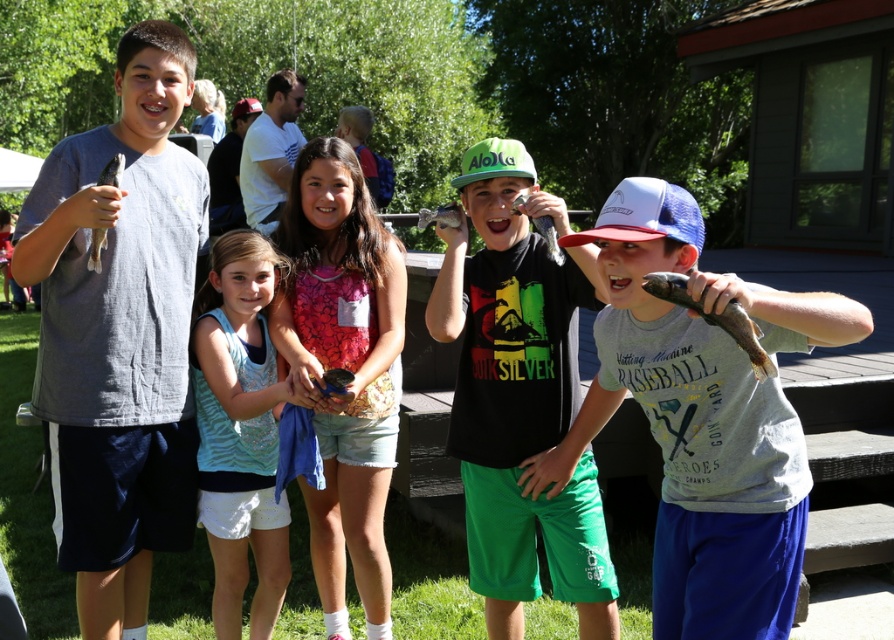
You are a photographer at the event and want to take a photo of both children wearing gray matte shirts. Since the gray matte shirt at left is larger in size than gray matte shirt at center, will you need to adjust the camera focus to account for their sizes?

Yes, you should adjust the camera focus because the gray matte shirt at left is larger in size than gray matte shirt at center, so the larger child might be out of focus if not adjusted properly.

What is the color of the shirt at the point with coordinates (702, 417)?

The point at coordinates (702, 417) is on the gray matte shirt at center, so the color is gray.